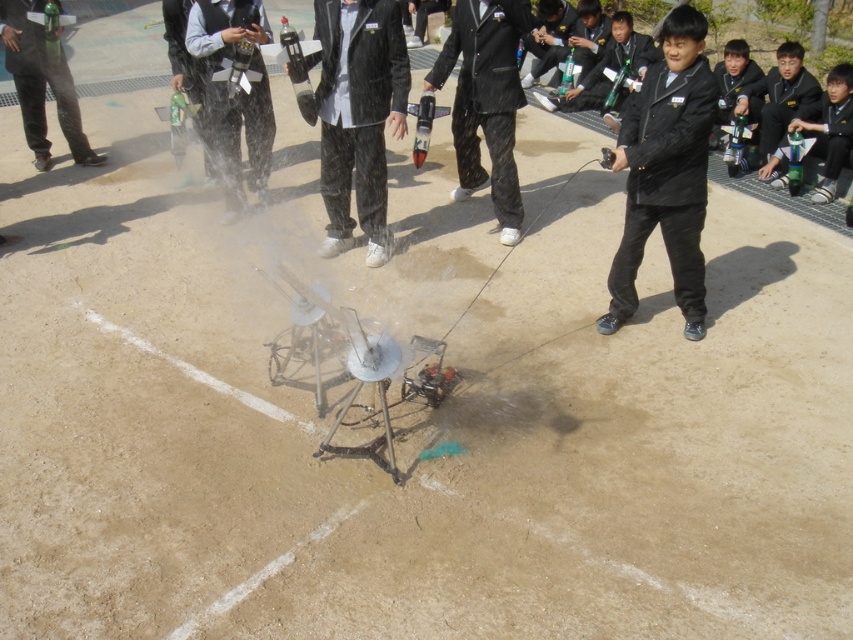
Who is lower down, black velvet suit at center or brushed metal water gun at center?

Positioned lower is black velvet suit at center.

Can you confirm if black velvet suit at center is positioned to the left of brushed metal water gun at center?

In fact, black velvet suit at center is to the right of brushed metal water gun at center.

Who is more forward, (x=329, y=113) or (x=260, y=120)?

Point (x=329, y=113) is more forward.

The image size is (853, 640). Find the location of `black velvet suit at center`. black velvet suit at center is located at coordinates (358, 115).

Between point (666, 141) and point (42, 58), which one is positioned behind?

Positioned behind is point (42, 58).

From the picture: Which is more to the left, black matte suit at center or matte black pants at left?

matte black pants at left

What are the coordinates of `black matte suit at center` in the screenshot? It's located at click(x=666, y=172).

What are the coordinates of `black matte suit at center` in the screenshot? It's located at (666, 172).

Does point (532, 19) come behind point (767, 157)?

No, (532, 19) is closer to viewer.

Image resolution: width=853 pixels, height=640 pixels. Describe the element at coordinates (486, 99) in the screenshot. I see `black textured suit at center` at that location.

Find the location of `black textured suit at center`. black textured suit at center is located at coordinates (486, 99).